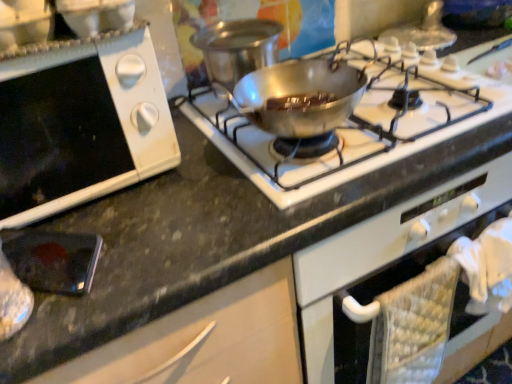
Question: Can you confirm if shiny silver pan at center is taller than white matte oven at lower left?

Choices:
 (A) no
 (B) yes

Answer: (A)

Question: Would you consider shiny silver pan at center to be distant from white matte oven at lower left?

Choices:
 (A) yes
 (B) no

Answer: (B)

Question: Could you tell me if shiny silver pan at center is turned towards white matte oven at lower left?

Choices:
 (A) yes
 (B) no

Answer: (B)

Question: From the image's perspective, is shiny silver pan at center beneath white matte oven at lower left?

Choices:
 (A) no
 (B) yes

Answer: (A)

Question: Does shiny silver pan at center appear on the right side of white matte oven at lower left?

Choices:
 (A) yes
 (B) no

Answer: (A)

Question: Is shiny silver pan at center positioned with its back to white matte oven at lower left?

Choices:
 (A) no
 (B) yes

Answer: (A)

Question: Is white matte oven at lower left oriented towards metallic silver pan at center?

Choices:
 (A) no
 (B) yes

Answer: (A)

Question: From the image's perspective, is white matte oven at lower left located above metallic silver pan at center?

Choices:
 (A) no
 (B) yes

Answer: (A)

Question: From a real-world perspective, is white matte oven at lower left on metallic silver pan at center?

Choices:
 (A) yes
 (B) no

Answer: (A)

Question: Does white matte oven at lower left lie behind metallic silver pan at center?

Choices:
 (A) yes
 (B) no

Answer: (B)

Question: Is white matte oven at lower left shorter than metallic silver pan at center?

Choices:
 (A) no
 (B) yes

Answer: (A)

Question: Is white matte oven at lower left closer to camera compared to metallic silver pan at center?

Choices:
 (A) no
 (B) yes

Answer: (B)

Question: Is metallic silver pan at center smaller than white matte oven at lower left?

Choices:
 (A) yes
 (B) no

Answer: (A)